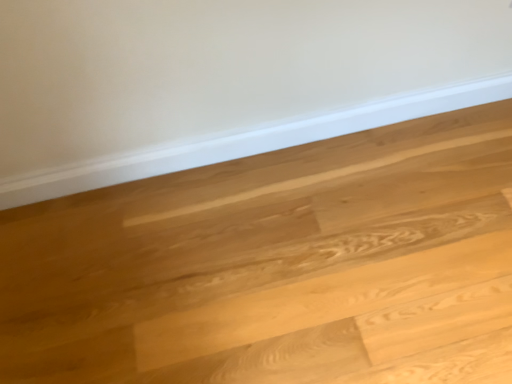
I want to click on empty space that is ontop of natural wood stairs at center (from a real-world perspective), so click(239, 293).